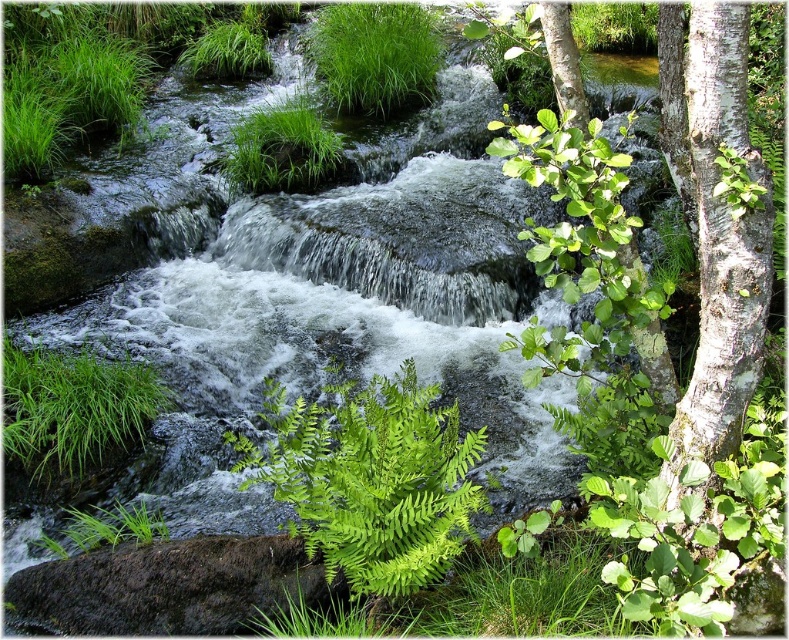
From the picture: You are a botanist examining the plants in the image. Which of the two plants, the green leafy fern at upper right or the green leafy grass at lower left, is taller?

The green leafy fern at upper right is much taller than the green leafy grass at lower left.

You are a botanist studying plant growth in this streamside environment. You observe the green leafy fern at upper right and the green leafy grass at lower left. Which of these plants has a greater overall size?

The green leafy fern at upper right has a larger size compared to the green leafy grass at lower left.